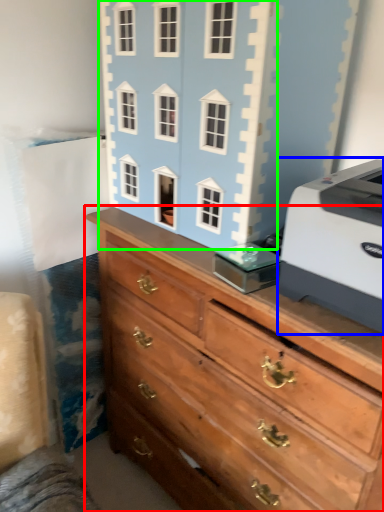
Question: Estimate the real-world distances between objects in this image. Which object is farther from chest of drawers (highlighted by a red box), printer (highlighted by a blue box) or toy (highlighted by a green box)?

Choices:
 (A) printer
 (B) toy

Answer: (B)